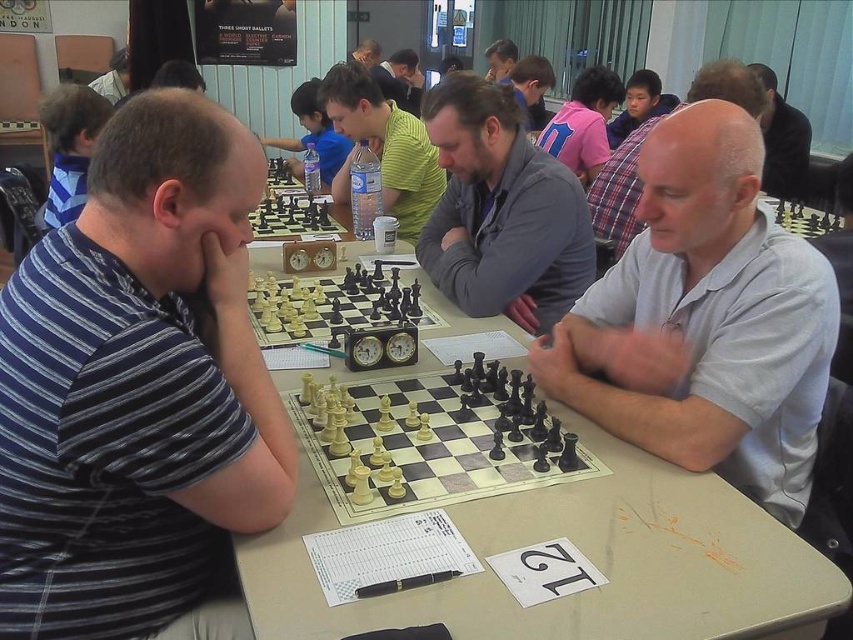
Question: Is white plastic chess set at center smaller than wooden chess set at center?

Choices:
 (A) yes
 (B) no

Answer: (A)

Question: Can you confirm if white smooth shirt at right is positioned to the left of gray wool sweater at center?

Choices:
 (A) yes
 (B) no

Answer: (B)

Question: Which of these objects is positioned farthest from the light beige plastic table at center?

Choices:
 (A) striped cotton shirt at left
 (B) black plastic chess set at center
 (C) white plastic chess set at center

Answer: (B)

Question: Which object appears farthest from the camera in this image?

Choices:
 (A) bald white shirt at center
 (B) green striped shirt at center
 (C) black plastic chess set at center
 (D) white plastic chess set at center

Answer: (B)

Question: Is black plastic chess set at center wider than wooden chess set at center?

Choices:
 (A) yes
 (B) no

Answer: (A)

Question: Which of the following is the closest to the observer?

Choices:
 (A) white smooth shirt at right
 (B) white plastic chess set at center
 (C) striped cotton shirt at left
 (D) green striped shirt at center

Answer: (C)